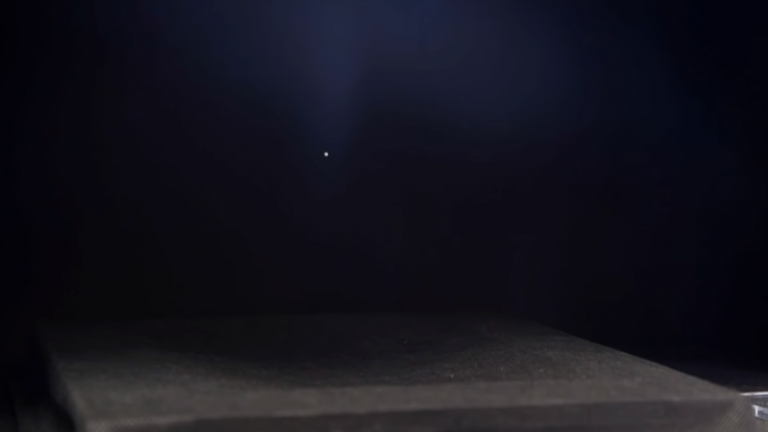
Find the location of a particular element. rug is located at coordinates (564, 375).